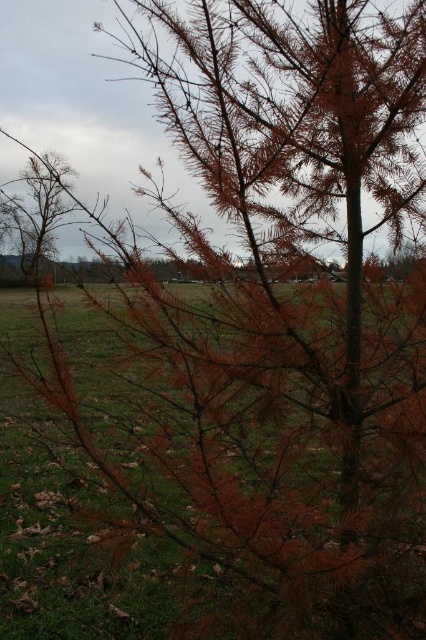
Who is shorter, brown matte tree at center or brown bark tree at left?

brown matte tree at center is shorter.

Where is `brown matte tree at center`? Image resolution: width=426 pixels, height=640 pixels. brown matte tree at center is located at coordinates (227, 461).

Who is more forward, (412, 497) or (54, 157)?

Point (412, 497) is more forward.

Locate an element on the screen. This screenshot has height=640, width=426. brown matte tree at center is located at coordinates (227, 461).